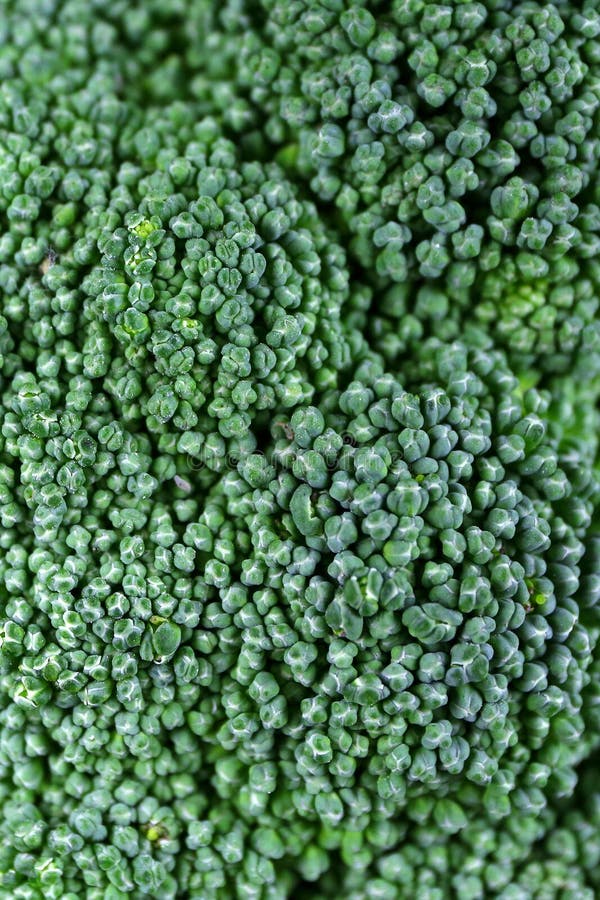
Image resolution: width=600 pixels, height=900 pixels. What are the coordinates of `corner` in the screenshot? It's located at (597, 2), (3, 896), (596, 896), (4, 1).